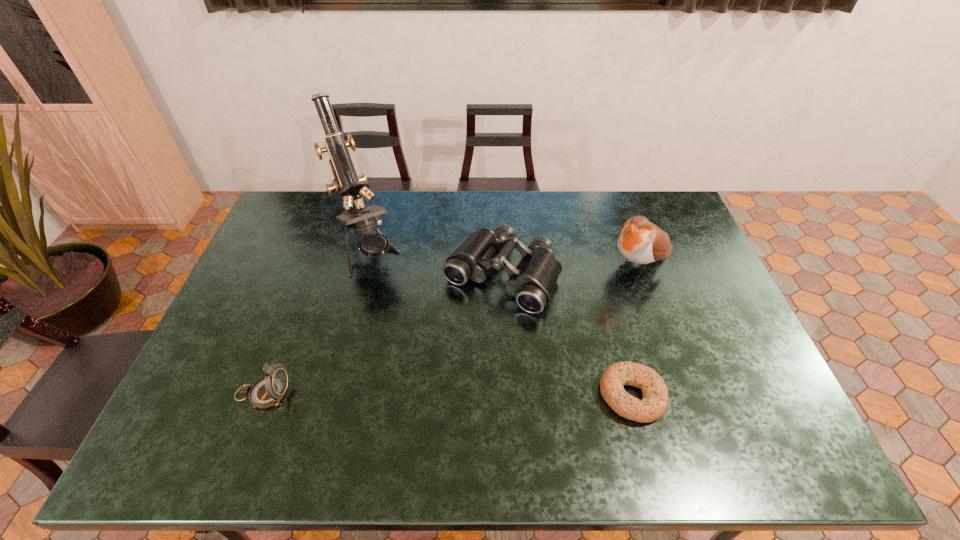
Locate an element on the screen. This screenshot has height=540, width=960. free space on the desktop that is between the compass and the bagel and is positioned at the face of the bird is located at coordinates (457, 395).

Identify the location of vacant spot on the desktop that is between the compass and the shortest object and is positioned through the eyepiece of the microscope. (449, 395).

Where is `free space on the desktop that is between the compass and the shortest object and is positioned on the front-facing side of the third object from left to right`? The image size is (960, 540). free space on the desktop that is between the compass and the shortest object and is positioned on the front-facing side of the third object from left to right is located at coordinates (421, 395).